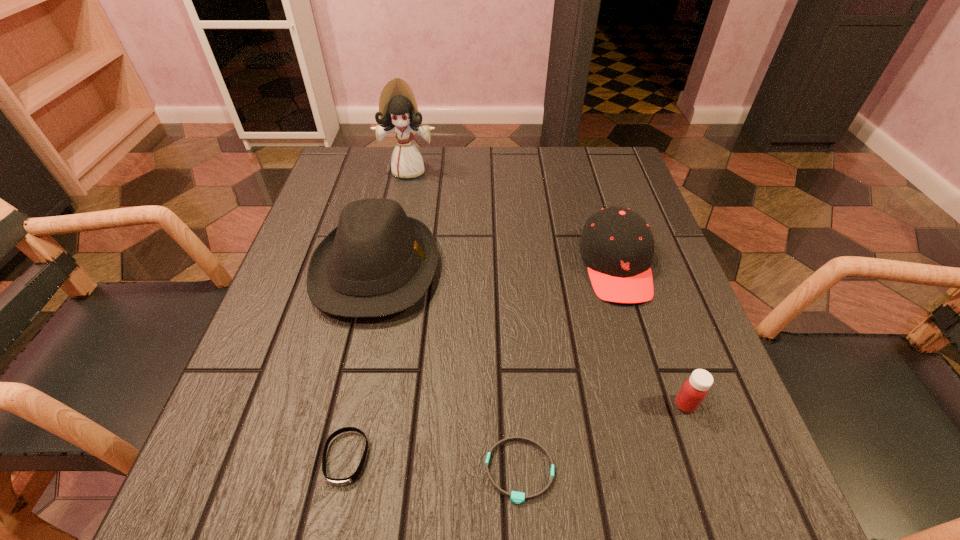
I want to click on vacant area between the third shortest object and the right wristband, so click(x=602, y=437).

I want to click on free space between the cap and the fifth shortest object, so click(496, 267).

Find the location of a particular element. unoccupied area between the fourth shortest object and the fifth shortest object is located at coordinates (496, 267).

At what (x,y) coordinates should I click in order to perform the action: click on vacant region between the fifth shortest object and the fourth shortest object. Please return your answer as a coordinate pair (x, y). The height and width of the screenshot is (540, 960). Looking at the image, I should click on (496, 267).

This screenshot has height=540, width=960. Find the location of `blank region between the tallest object and the third object from right to left`. blank region between the tallest object and the third object from right to left is located at coordinates (465, 321).

Select which object is the second closest to the fourth tallest object. Please provide its 2D coordinates. Your answer should be formatted as a tuple, i.e. [(x, y)], where the tuple contains the x and y coordinates of a point satisfying the conditions above.

[(516, 497)]

Locate an element on the screen. object that is the fifth nearest to the left wristband is located at coordinates (398, 111).

This screenshot has height=540, width=960. Find the location of `free space that satisfies the following two spatial constraints: 1. at the front face of the tallest object; 2. on the right side of the fourth tallest object`. free space that satisfies the following two spatial constraints: 1. at the front face of the tallest object; 2. on the right side of the fourth tallest object is located at coordinates (362, 404).

In order to click on vacant area that satisfies the following two spatial constraints: 1. on the front-facing side of the cap; 2. on the front-facing side of the fedora in this screenshot , I will do `click(617, 269)`.

At what (x,y) coordinates should I click in order to perform the action: click on free spot that satisfies the following two spatial constraints: 1. on the front-facing side of the third shortest object; 2. on the right side of the second tallest object. Please return your answer as a coordinate pair (x, y). Looking at the image, I should click on (345, 404).